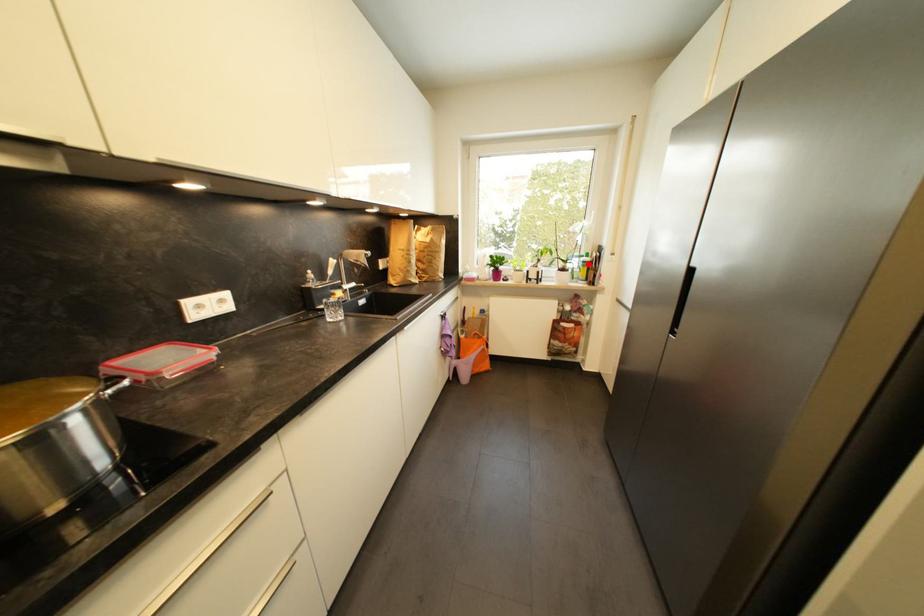
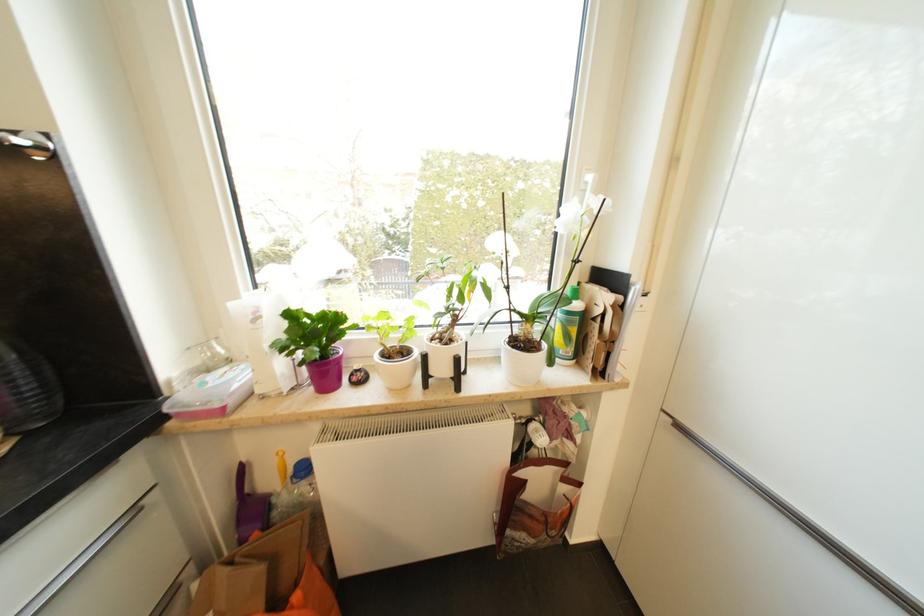
Find the pixel in the second image that matches the highlighted location in the first image.

(574, 315)